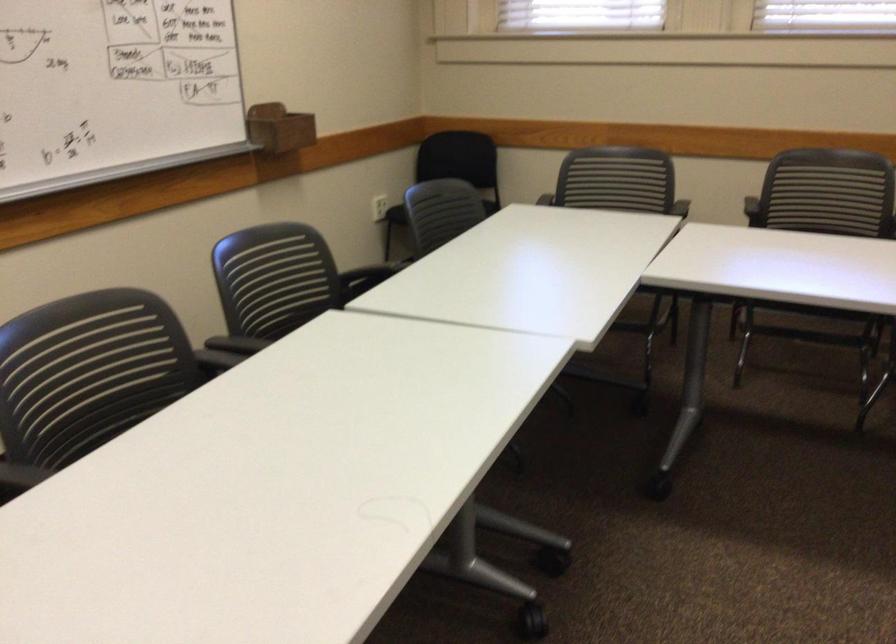
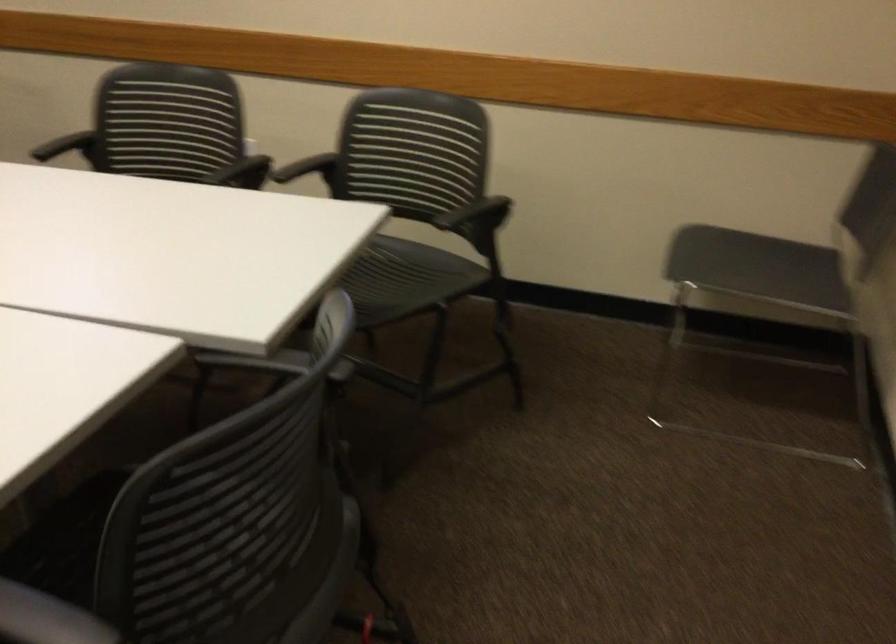
Question: Which direction would the cameraman need to move to produce the second image? Reply with the corresponding letter.

Choices:
 (A) Left
 (B) Right
 (C) Forward
 (D) Backward

Answer: (B)